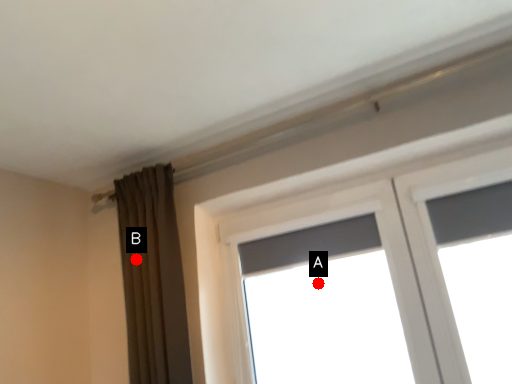
Question: Two points are circled on the image, labeled by A and B beside each circle. Which point is closer to the camera?

Choices:
 (A) A is closer
 (B) B is closer

Answer: (B)